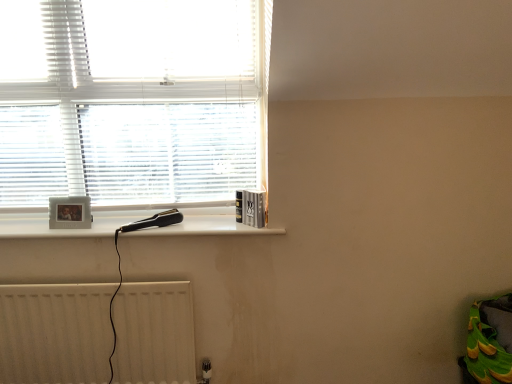
Image resolution: width=512 pixels, height=384 pixels. What are the coordinates of `empty space that is ontop of white plastic hairdryer at upper left (from a real-world perspective)` in the screenshot? It's located at (130, 225).